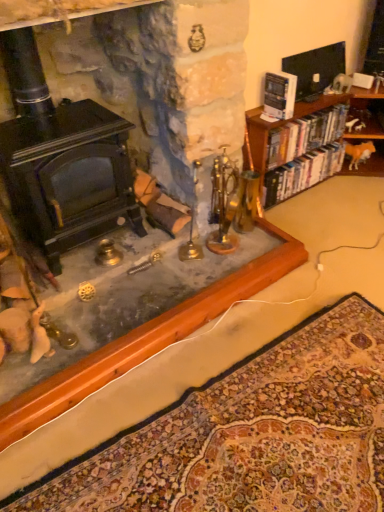
Question: Considering the relative positions of hardcover books at right, marked as the second book in a front-to-back arrangement, and carpeted mat at lower center in the image provided, is hardcover books at right, marked as the second book in a front-to-back arrangement, to the right of carpeted mat at lower center from the viewer's perspective?

Choices:
 (A) no
 (B) yes

Answer: (B)

Question: Does hardcover books at right, marked as the second book in a front-to-back arrangement, have a greater height compared to carpeted mat at lower center?

Choices:
 (A) yes
 (B) no

Answer: (A)

Question: Is hardcover books at right, marked as the second book in a front-to-back arrangement, wider than carpeted mat at lower center?

Choices:
 (A) no
 (B) yes

Answer: (A)

Question: From a real-world perspective, is hardcover books at right, marked as the second book in a front-to-back arrangement, located higher than carpeted mat at lower center?

Choices:
 (A) no
 (B) yes

Answer: (B)

Question: Does hardcover books at right, marked as the second book in a front-to-back arrangement, lie in front of carpeted mat at lower center?

Choices:
 (A) no
 (B) yes

Answer: (A)

Question: Is hardcover books at right, the second book viewed from the back, shorter than carpeted mat at lower center?

Choices:
 (A) no
 (B) yes

Answer: (A)

Question: Is hardcover books at right, which ranks as the 3th book in front-to-back order, at the left side of black matte fireplace at left?

Choices:
 (A) no
 (B) yes

Answer: (A)

Question: Are hardcover books at right, the first book when ordered from back to front, and black matte fireplace at left beside each other?

Choices:
 (A) yes
 (B) no

Answer: (B)

Question: Is hardcover books at right, the first book when ordered from back to front, looking in the opposite direction of black matte fireplace at left?

Choices:
 (A) yes
 (B) no

Answer: (B)

Question: Could you tell me if hardcover books at right, which ranks as the 3th book in front-to-back order, is turned towards black matte fireplace at left?

Choices:
 (A) no
 (B) yes

Answer: (A)

Question: Is hardcover books at right, the first book when ordered from back to front, wider than black matte fireplace at left?

Choices:
 (A) no
 (B) yes

Answer: (A)

Question: Is hardcover books at right, the first book when ordered from back to front, at the right side of black matte fireplace at left?

Choices:
 (A) no
 (B) yes

Answer: (B)

Question: Considering the relative sizes of carpeted mat at lower center and hardcover books at right, the second book viewed from the back, in the image provided, is carpeted mat at lower center taller than hardcover books at right, the second book viewed from the back,?

Choices:
 (A) no
 (B) yes

Answer: (A)